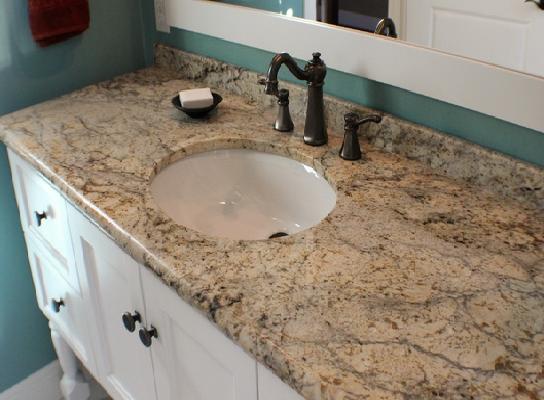
Find the location of `mirror`. mirror is located at coordinates (403, 20).